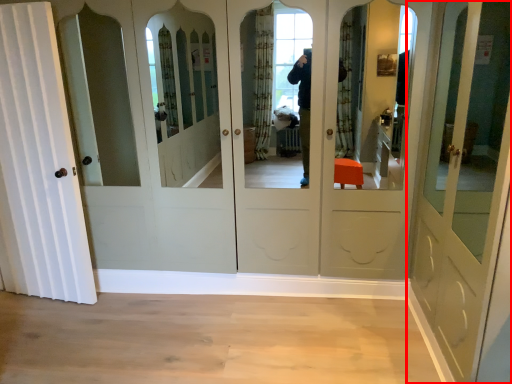
Question: Considering the relative positions of door (annotated by the red box) and door in the image provided, where is door (annotated by the red box) located with respect to the staircase?

Choices:
 (A) left
 (B) right

Answer: (B)